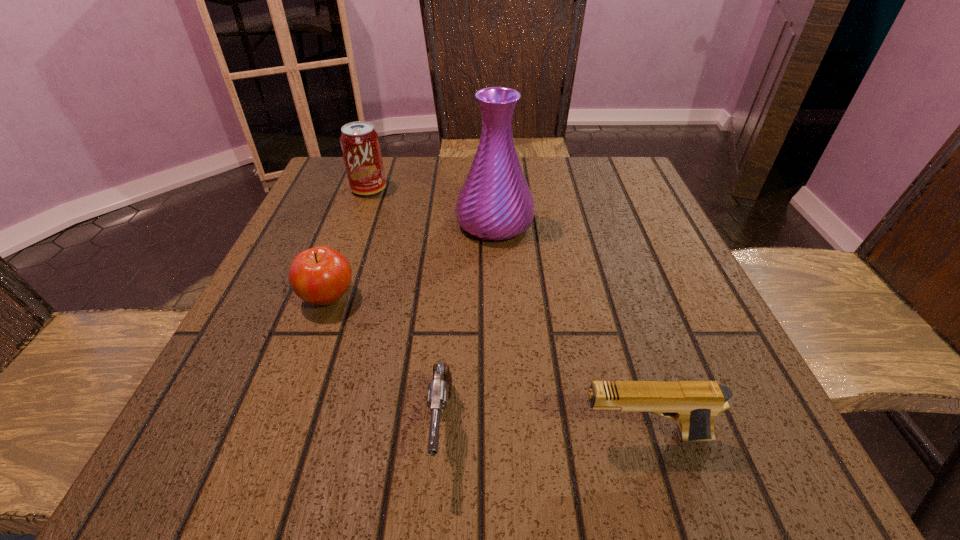
This screenshot has width=960, height=540. In the image, there is a desktop. Find the location of `vacant area at the far edge`. vacant area at the far edge is located at coordinates (437, 158).

Find the location of a particular element. This screenshot has height=540, width=960. vacant space at the near edge of the desktop is located at coordinates [387, 449].

The width and height of the screenshot is (960, 540). Find the location of `vacant space at the left edge of the desktop`. vacant space at the left edge of the desktop is located at coordinates (364, 228).

I want to click on vacant region at the right edge of the desktop, so click(643, 237).

The width and height of the screenshot is (960, 540). In the image, there is a desktop. Find the location of `vacant space at the far right corner`. vacant space at the far right corner is located at coordinates (610, 180).

Find the location of `free space at the near right corner of the desktop`. free space at the near right corner of the desktop is located at coordinates (773, 448).

Image resolution: width=960 pixels, height=540 pixels. Find the location of `unoccupied position between the fourth shortest object and the left pistol`. unoccupied position between the fourth shortest object and the left pistol is located at coordinates (405, 308).

Locate an element on the screen. free space between the soda can and the third farthest object is located at coordinates (348, 244).

At what (x,y) coordinates should I click in order to perform the action: click on unoccupied area between the left pistol and the rightmost object. Please return your answer as a coordinate pair (x, y). Image resolution: width=960 pixels, height=540 pixels. Looking at the image, I should click on (542, 432).

Where is `empty location between the apple and the fourth nearest object`? The width and height of the screenshot is (960, 540). empty location between the apple and the fourth nearest object is located at coordinates (411, 260).